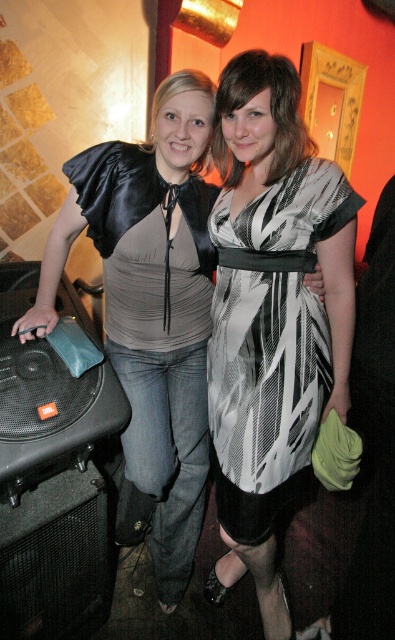
Question: Which of the following is the closest to the observer?

Choices:
 (A) black and white striped dress at center
 (B) black and white printed dress at center

Answer: (A)

Question: Which point is closer to the camera?

Choices:
 (A) black and white striped dress at center
 (B) black and white printed dress at center
 (C) black mesh speaker at lower left
 (D) black plastic speaker at lower left

Answer: (D)

Question: Is black plastic speaker at lower left behind black mesh speaker at lower left?

Choices:
 (A) yes
 (B) no

Answer: (B)

Question: Is black plastic speaker at lower left closer to the viewer compared to black and white striped dress at center?

Choices:
 (A) no
 (B) yes

Answer: (B)

Question: Is black and white printed dress at center above black plastic speaker at lower left?

Choices:
 (A) no
 (B) yes

Answer: (A)

Question: Which of these objects is positioned farthest from the black mesh speaker at lower left?

Choices:
 (A) black and white striped dress at center
 (B) black plastic speaker at lower left

Answer: (A)